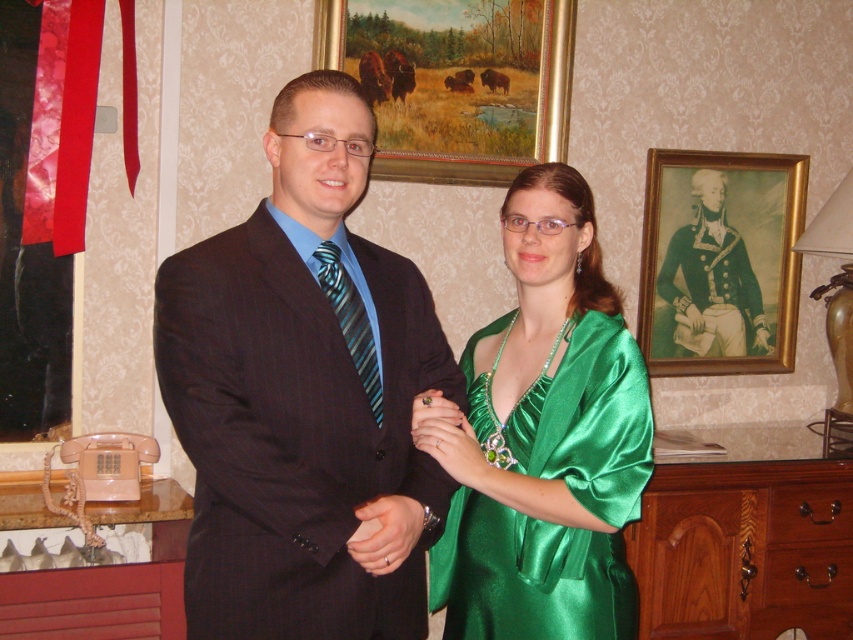
Question: Estimate the real-world distances between objects in this image. Which object is closer to the matte black suit at center?

Choices:
 (A) gold-framed painting of bison at upper center
 (B) green satin dress at center
 (C) blue striped tie at center

Answer: (C)

Question: Can you confirm if matte black suit at center is positioned above gold-framed painting of bison at upper center?

Choices:
 (A) no
 (B) yes

Answer: (A)

Question: Which point is farther to the camera?

Choices:
 (A) (322, 289)
 (B) (358, 589)
 (C) (541, 541)
 (D) (741, 300)

Answer: (D)

Question: Which object is farther from the camera taking this photo?

Choices:
 (A) blue striped tie at center
 (B) green satin robe at center
 (C) brown wood dresser at lower right

Answer: (B)

Question: Can you confirm if green satin robe at center is thinner than blue striped tie at center?

Choices:
 (A) no
 (B) yes

Answer: (A)

Question: Can you confirm if matte black suit at center is positioned to the left of brown wood dresser at lower right?

Choices:
 (A) no
 (B) yes

Answer: (B)